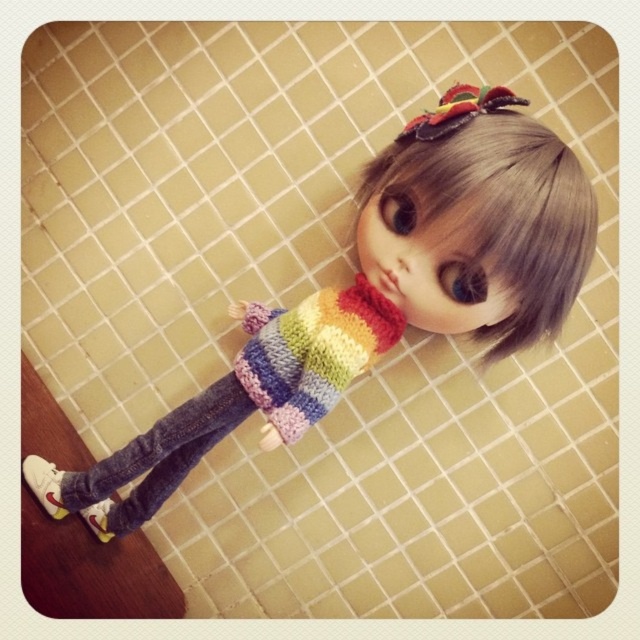
Question: Does blonde synthetic wig at upper center have a larger size compared to denim jeans at lower left?

Choices:
 (A) yes
 (B) no

Answer: (A)

Question: Estimate the real-world distances between objects in this image. Which object is farther from the knitted rainbow sweater at center?

Choices:
 (A) blonde synthetic wig at upper center
 (B) denim jeans at lower left
 (C) knitted rainbow sweater at upper center

Answer: (A)

Question: Among these points, which one is nearest to the camera?

Choices:
 (A) (538, 205)
 (B) (264, 316)

Answer: (A)

Question: Is knitted rainbow sweater at upper center thinner than denim jeans at lower left?

Choices:
 (A) yes
 (B) no

Answer: (B)

Question: Which point is farther to the camera?

Choices:
 (A) blonde synthetic wig at upper center
 (B) knitted rainbow sweater at center
 (C) denim jeans at lower left
 (D) knitted rainbow sweater at upper center

Answer: (C)

Question: Does knitted rainbow sweater at upper center appear over denim jeans at lower left?

Choices:
 (A) yes
 (B) no

Answer: (A)